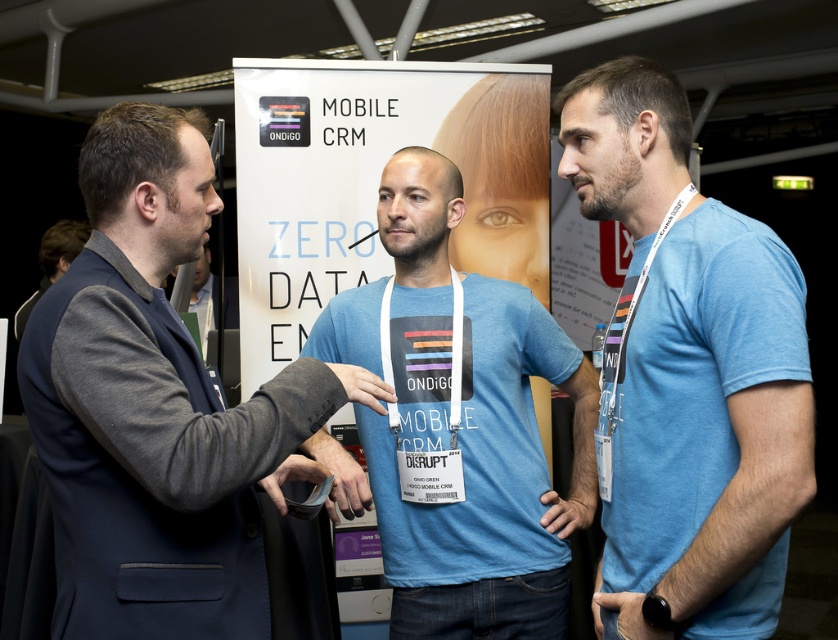
Question: Which point is farther from the camera taking this photo?

Choices:
 (A) (138, 403)
 (B) (329, 468)

Answer: (B)

Question: Which point appears closest to the camera in this image?

Choices:
 (A) (407, 541)
 (B) (184, 115)

Answer: (B)

Question: Based on their relative distances, which object is farther from the blue heather t-shirt at right?

Choices:
 (A) matte black wristband at center
 (B) dark gray blazer at left

Answer: (A)

Question: Can you confirm if blue cotton t-shirt at center is positioned below matte blue shirt at center?

Choices:
 (A) no
 (B) yes

Answer: (B)

Question: Can you confirm if blue cotton t-shirt at center is bigger than dark blue suit at left?

Choices:
 (A) no
 (B) yes

Answer: (A)

Question: Is dark gray blazer at left closer to camera compared to blue cotton t-shirt at center?

Choices:
 (A) no
 (B) yes

Answer: (B)